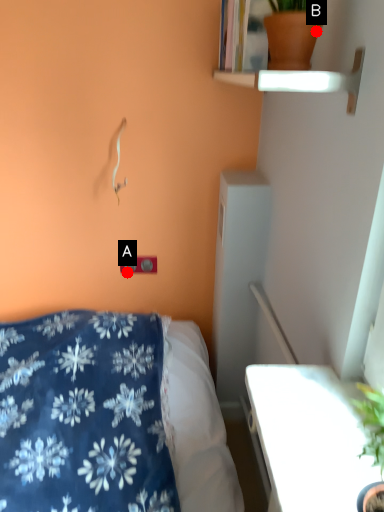
Question: Two points are circled on the image, labeled by A and B beside each circle. Among these points, which one is nearest to the camera?

Choices:
 (A) A is closer
 (B) B is closer

Answer: (B)